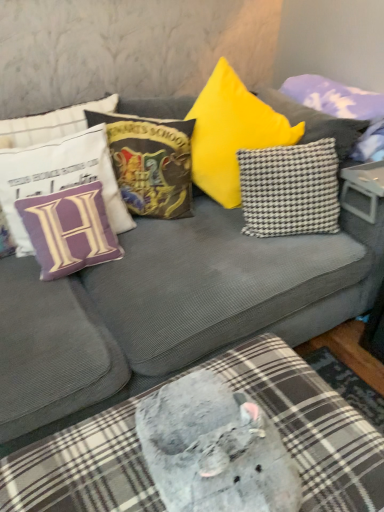
How much space does purple fabric pillow at left, the fourth pillow when ordered from right to left, occupy vertically?

purple fabric pillow at left, the fourth pillow when ordered from right to left, is 10.63 inches in height.

What is the approximate height of plush gray cushion at lower center?

plush gray cushion at lower center is 12.89 inches tall.

You are a GUI agent. You are given a task and a screenshot of the screen. Output one action in this format:
    pyautogui.click(x=<x>, y=<y>)
    Task: Click on the plush gray cushion at lower center
    The width and height of the screenshot is (384, 512).
    Given the screenshot: What is the action you would take?
    pyautogui.click(x=311, y=425)

At what (x,y) coordinates should I click in order to perform the action: click on plastic gray table at center. Please return your answer as a coordinate pair (x, y). Looking at the image, I should click on (364, 187).

Where is `velvet hogwarts school of witchcraft and wizardry pillow at upper center, which is counted as the third pillow, starting from the right`? velvet hogwarts school of witchcraft and wizardry pillow at upper center, which is counted as the third pillow, starting from the right is located at coordinates (x=150, y=162).

From a real-world perspective, is plastic gray table at center on top of black-and-white checkered pillow at center-right, positioned as the 2th pillow in right-to-left order?

No, from a real-world perspective, plastic gray table at center is not on top of black-and-white checkered pillow at center-right, positioned as the 2th pillow in right-to-left order.

In terms of height, does plastic gray table at center look taller or shorter compared to black-and-white checkered pillow at center-right, positioned as the 2th pillow in right-to-left order?

In the image, plastic gray table at center appears to be shorter than black-and-white checkered pillow at center-right, positioned as the 2th pillow in right-to-left order.

From the image's perspective, between plastic gray table at center and black-and-white checkered pillow at center-right, positioned as the 4th pillow in left-to-right order, who is located below?

black-and-white checkered pillow at center-right, positioned as the 4th pillow in left-to-right order, is shown below in the image.

How different are the orientations of checkered fabric pillow at upper right, which appears as the 5th pillow when viewed from the left, and white fabric pillow with purple letter h at upper left, the 1th pillow in the left-to-right sequence, in degrees?

There is a 90-degree angle between the facing directions of checkered fabric pillow at upper right, which appears as the 5th pillow when viewed from the left, and white fabric pillow with purple letter h at upper left, the 1th pillow in the left-to-right sequence.

From the image's perspective, which is above, checkered fabric pillow at upper right, which appears as the 5th pillow when viewed from the left, or white fabric pillow with purple letter h at upper left, which appears as the fifth pillow when viewed from the right?

checkered fabric pillow at upper right, which appears as the 5th pillow when viewed from the left.

Is checkered fabric pillow at upper right, which appears as the 5th pillow when viewed from the left, directly adjacent to white fabric pillow with purple letter h at upper left, the 1th pillow in the left-to-right sequence?

No, checkered fabric pillow at upper right, which appears as the 5th pillow when viewed from the left, is not making contact with white fabric pillow with purple letter h at upper left, the 1th pillow in the left-to-right sequence.

Which object is more forward, checkered fabric pillow at upper right, which appears as the 5th pillow when viewed from the left, or white fabric pillow with purple letter h at upper left, which appears as the fifth pillow when viewed from the right?

white fabric pillow with purple letter h at upper left, which appears as the fifth pillow when viewed from the right, is in front.

Does plush gray cushion at lower center have a lesser width compared to black-and-white checkered pillow at center-right, positioned as the 4th pillow in left-to-right order?

No, plush gray cushion at lower center is not thinner than black-and-white checkered pillow at center-right, positioned as the 4th pillow in left-to-right order.

From the image's perspective, is plush gray cushion at lower center located above black-and-white checkered pillow at center-right, positioned as the 4th pillow in left-to-right order?

Incorrect, from the image's perspective, plush gray cushion at lower center is lower than black-and-white checkered pillow at center-right, positioned as the 4th pillow in left-to-right order.

From a real-world perspective, between plush gray cushion at lower center and black-and-white checkered pillow at center-right, positioned as the 2th pillow in right-to-left order, who is vertically lower?

In real-world perspective, plush gray cushion at lower center is lower.

Is plush gray cushion at lower center facing towards black-and-white checkered pillow at center-right, positioned as the 4th pillow in left-to-right order?

No, plush gray cushion at lower center is not turned towards black-and-white checkered pillow at center-right, positioned as the 4th pillow in left-to-right order.

Does velvet hogwarts school of witchcraft and wizardry pillow at upper center, which ranks as the third pillow in left-to-right order, have a larger size compared to purple fabric pillow at left, which ranks as the second pillow in left-to-right order?

Correct, velvet hogwarts school of witchcraft and wizardry pillow at upper center, which ranks as the third pillow in left-to-right order, is larger in size than purple fabric pillow at left, which ranks as the second pillow in left-to-right order.

Is velvet hogwarts school of witchcraft and wizardry pillow at upper center, which ranks as the third pillow in left-to-right order, closer to camera compared to purple fabric pillow at left, which ranks as the second pillow in left-to-right order?

No, it is behind purple fabric pillow at left, which ranks as the second pillow in left-to-right order.

Is point (167, 172) in front of point (94, 216)?

No, it is not.

Is velvet hogwarts school of witchcraft and wizardry pillow at upper center, which is counted as the third pillow, starting from the right, not close to purple fabric pillow at left, the fourth pillow when ordered from right to left?

Actually, velvet hogwarts school of witchcraft and wizardry pillow at upper center, which is counted as the third pillow, starting from the right, and purple fabric pillow at left, the fourth pillow when ordered from right to left, are a little close together.

Is the surface of purple fabric pillow at left, the fourth pillow when ordered from right to left, in direct contact with black-and-white checkered pillow at center-right, positioned as the 2th pillow in right-to-left order?

No.

Looking at this image, between purple fabric pillow at left, the fourth pillow when ordered from right to left, and black-and-white checkered pillow at center-right, positioned as the 4th pillow in left-to-right order, which one is positioned behind?

black-and-white checkered pillow at center-right, positioned as the 4th pillow in left-to-right order.

How many degrees apart are the facing directions of purple fabric pillow at left, the fourth pillow when ordered from right to left, and black-and-white checkered pillow at center-right, positioned as the 4th pillow in left-to-right order?

They differ by 28.6 degrees in their facing directions.

From the image's perspective, count 2nd pillows upward from the purple fabric pillow at left, which ranks as the second pillow in left-to-right order, and point to it. Please provide its 2D coordinates.

[(290, 189)]

Is white fabric pillow with purple letter h at upper left, the 1th pillow in the left-to-right sequence, completely or partially inside black-and-white checkered pillow at center-right, positioned as the 2th pillow in right-to-left order?

No, black-and-white checkered pillow at center-right, positioned as the 2th pillow in right-to-left order, does not contain white fabric pillow with purple letter h at upper left, the 1th pillow in the left-to-right sequence.

Is point (286, 215) farther from viewer compared to point (79, 148)?

That is True.

Who is shorter, black-and-white checkered pillow at center-right, positioned as the 2th pillow in right-to-left order, or white fabric pillow with purple letter h at upper left, the 1th pillow in the left-to-right sequence?

With less height is black-and-white checkered pillow at center-right, positioned as the 2th pillow in right-to-left order.

Is white fabric pillow with purple letter h at upper left, the 1th pillow in the left-to-right sequence, with black-and-white checkered pillow at center-right, positioned as the 2th pillow in right-to-left order?

No, white fabric pillow with purple letter h at upper left, the 1th pillow in the left-to-right sequence, is not with black-and-white checkered pillow at center-right, positioned as the 2th pillow in right-to-left order.

Is white fabric pillow with purple letter h at upper left, which appears as the fifth pillow when viewed from the right, completely or partially outside of black-and-white checkered pillow at center-right, positioned as the 2th pillow in right-to-left order?

Yes, white fabric pillow with purple letter h at upper left, which appears as the fifth pillow when viewed from the right, is outside of black-and-white checkered pillow at center-right, positioned as the 2th pillow in right-to-left order.

In the image, is white fabric pillow with purple letter h at upper left, the 1th pillow in the left-to-right sequence, on the left side or the right side of black-and-white checkered pillow at center-right, positioned as the 2th pillow in right-to-left order?

white fabric pillow with purple letter h at upper left, the 1th pillow in the left-to-right sequence, is to the left of black-and-white checkered pillow at center-right, positioned as the 2th pillow in right-to-left order.

Which point is more forward, (71, 136) or (292, 184)?

The point (71, 136) is closer to the camera.

Where is `table above the black-and-white checkered pillow at center-right, positioned as the 4th pillow in left-to-right order (from the image's perspective)`? The width and height of the screenshot is (384, 512). table above the black-and-white checkered pillow at center-right, positioned as the 4th pillow in left-to-right order (from the image's perspective) is located at coordinates (364, 187).

Identify the location of pillow that is the 3rd object located below the checkered fabric pillow at upper right, acting as the 1th pillow starting from the right (from the image's perspective). The height and width of the screenshot is (512, 384). (59, 178).

Based on their spatial positions, is black-and-white checkered pillow at center-right, positioned as the 2th pillow in right-to-left order, or velvet hogwarts school of witchcraft and wizardry pillow at upper center, which is counted as the third pillow, starting from the right, further from plastic gray table at center?

velvet hogwarts school of witchcraft and wizardry pillow at upper center, which is counted as the third pillow, starting from the right, is further to plastic gray table at center.

Which object lies further to the anchor point purple fabric pillow at left, the fourth pillow when ordered from right to left, velvet hogwarts school of witchcraft and wizardry pillow at upper center, which ranks as the third pillow in left-to-right order, or black-and-white checkered pillow at center-right, positioned as the 2th pillow in right-to-left order?

black-and-white checkered pillow at center-right, positioned as the 2th pillow in right-to-left order.

Based on their spatial positions, is white fabric pillow with purple letter h at upper left, which appears as the fifth pillow when viewed from the right, or black-and-white checkered pillow at center-right, positioned as the 4th pillow in left-to-right order, further from plush gray cushion at lower center?

The object further to plush gray cushion at lower center is white fabric pillow with purple letter h at upper left, which appears as the fifth pillow when viewed from the right.

Which object lies further to the anchor point purple fabric pillow at left, the fourth pillow when ordered from right to left, white fabric pillow with purple letter h at upper left, which appears as the fifth pillow when viewed from the right, or checkered fabric pillow at upper right, which appears as the 5th pillow when viewed from the left?

checkered fabric pillow at upper right, which appears as the 5th pillow when viewed from the left, is further to purple fabric pillow at left, the fourth pillow when ordered from right to left.

Looking at the image, which one is located further to velvet hogwarts school of witchcraft and wizardry pillow at upper center, which is counted as the third pillow, starting from the right, checkered fabric pillow at upper right, acting as the 1th pillow starting from the right, or purple fabric pillow at left, which ranks as the second pillow in left-to-right order?

checkered fabric pillow at upper right, acting as the 1th pillow starting from the right, lies further to velvet hogwarts school of witchcraft and wizardry pillow at upper center, which is counted as the third pillow, starting from the right, than the other object.

Based on their spatial positions, is plush gray cushion at lower center or purple fabric pillow at left, the fourth pillow when ordered from right to left, further from velvet hogwarts school of witchcraft and wizardry pillow at upper center, which ranks as the third pillow in left-to-right order?

Based on the image, plush gray cushion at lower center appears to be further to velvet hogwarts school of witchcraft and wizardry pillow at upper center, which ranks as the third pillow in left-to-right order.

From the image, which object appears to be nearer to white fabric pillow with purple letter h at upper left, the 1th pillow in the left-to-right sequence, checkered fabric pillow at upper right, acting as the 1th pillow starting from the right, or purple fabric pillow at left, the fourth pillow when ordered from right to left?

Based on the image, purple fabric pillow at left, the fourth pillow when ordered from right to left, appears to be nearer to white fabric pillow with purple letter h at upper left, the 1th pillow in the left-to-right sequence.

Considering their positions, is white fabric pillow with purple letter h at upper left, which appears as the fifth pillow when viewed from the right, positioned further to checkered fabric pillow at upper right, which appears as the 5th pillow when viewed from the left, than purple fabric pillow at left, which ranks as the second pillow in left-to-right order?

The object further to checkered fabric pillow at upper right, which appears as the 5th pillow when viewed from the left, is purple fabric pillow at left, which ranks as the second pillow in left-to-right order.

Where is `table that lies between velvet hogwarts school of witchcraft and wizardry pillow at upper center, which ranks as the third pillow in left-to-right order, and plush gray cushion at lower center from top to bottom`? table that lies between velvet hogwarts school of witchcraft and wizardry pillow at upper center, which ranks as the third pillow in left-to-right order, and plush gray cushion at lower center from top to bottom is located at coordinates (364, 187).

In order to click on pillow situated between purple fabric pillow at left, which ranks as the second pillow in left-to-right order, and black-and-white checkered pillow at center-right, positioned as the 4th pillow in left-to-right order, from left to right in this screenshot , I will do click(150, 162).

At what (x,y) coordinates should I click in order to perform the action: click on table that lies between checkered fabric pillow at upper right, acting as the 1th pillow starting from the right, and black-and-white checkered pillow at center-right, positioned as the 2th pillow in right-to-left order, from top to bottom. Please return your answer as a coordinate pair (x, y). Looking at the image, I should click on (364, 187).

In order to click on pillow that lies between white fabric pillow with purple letter h at upper left, which appears as the fifth pillow when viewed from the right, and plush gray cushion at lower center from top to bottom in this screenshot , I will do `click(69, 230)`.